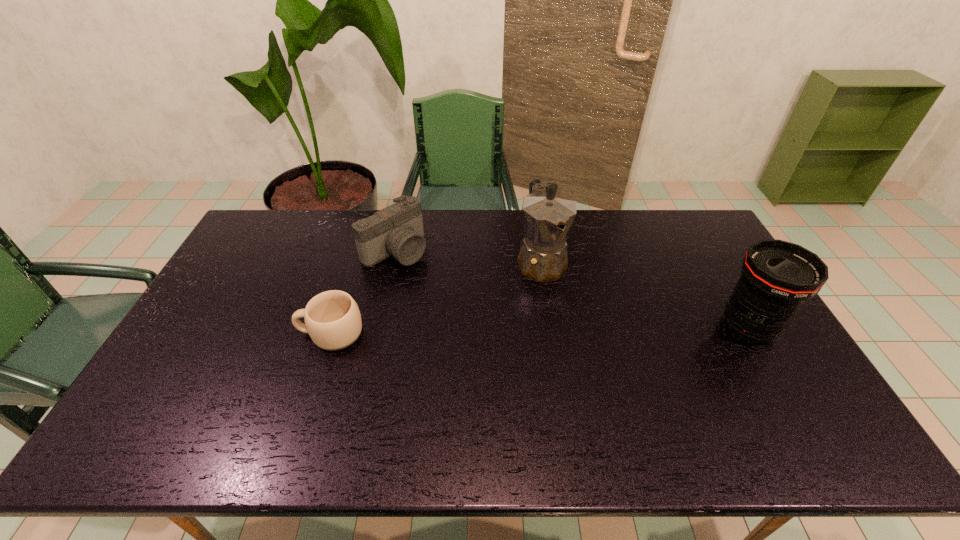
The image size is (960, 540). In order to click on vacant space at the near edge of the desktop in this screenshot , I will do `click(214, 407)`.

Where is `free space at the left edge of the desktop`? free space at the left edge of the desktop is located at coordinates (257, 280).

In the image, there is a desktop. Where is `blank space at the right edge`? The height and width of the screenshot is (540, 960). blank space at the right edge is located at coordinates (730, 330).

Find the location of a particular element. The width and height of the screenshot is (960, 540). free region at the far left corner is located at coordinates (239, 246).

Find the location of `vacant space at the far right corner of the desktop`. vacant space at the far right corner of the desktop is located at coordinates (688, 211).

Find the location of a particular element. free space between the third tallest object and the second object from right to left is located at coordinates (468, 256).

Where is `free space between the coffeepot and the mug`? free space between the coffeepot and the mug is located at coordinates (436, 298).

You are a GUI agent. You are given a task and a screenshot of the screen. Output one action in this format:
    pyautogui.click(x=<x>, y=<y>)
    Task: Click on the vacant point located between the telephoto lens and the tallest object
    
    Given the screenshot: What is the action you would take?
    pyautogui.click(x=645, y=294)

The height and width of the screenshot is (540, 960). In order to click on free space between the third object from left to right and the telephoto lens in this screenshot , I will do `click(645, 294)`.

Identify the location of free space between the camera and the rightmost object. (572, 288).